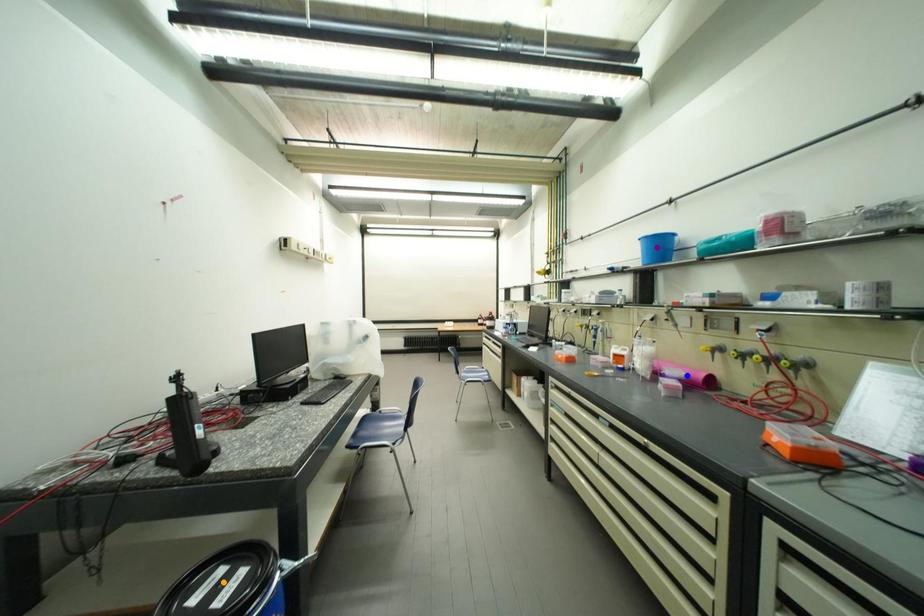
Order these from nearest to farthest:
A) purple point
B) orange point
C) blue point

orange point < blue point < purple point